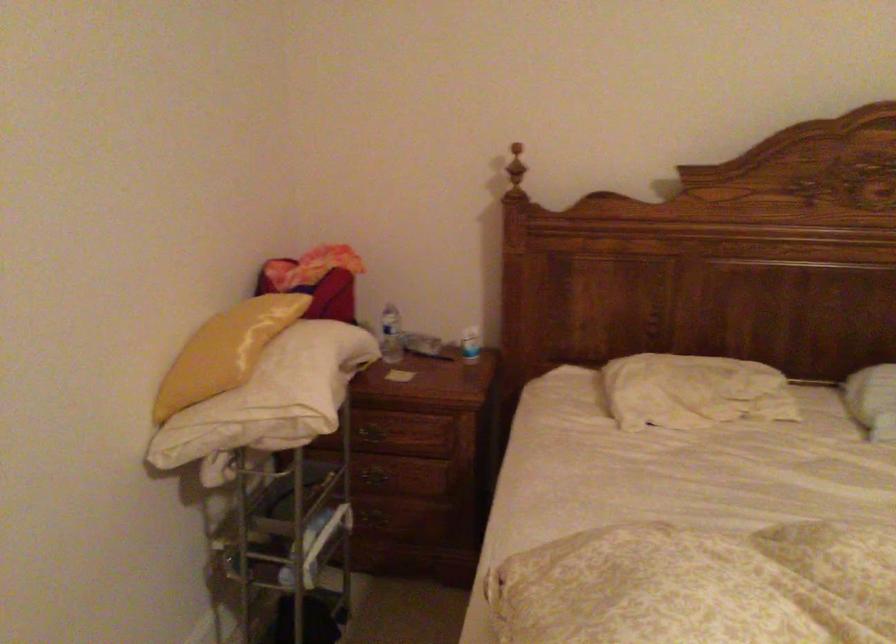
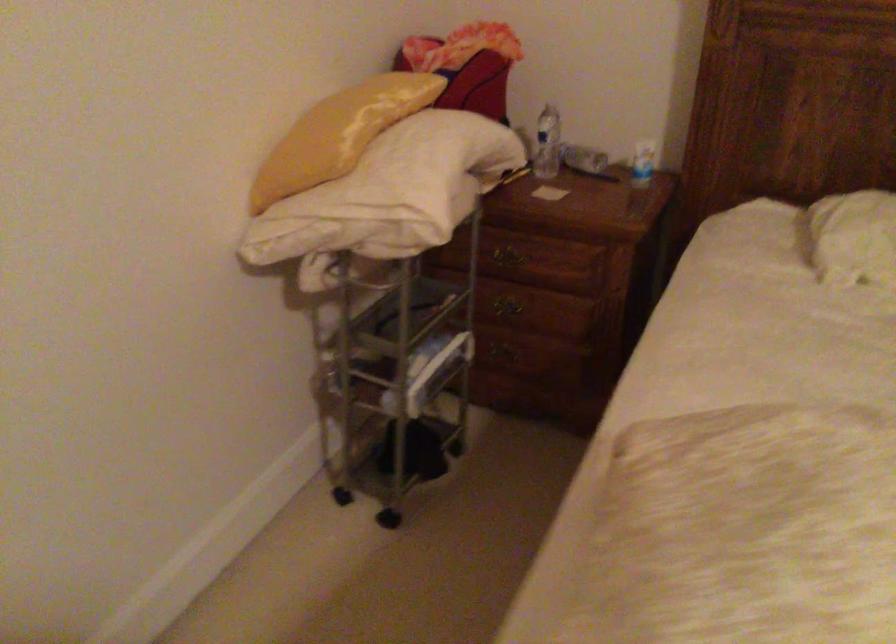
Question: What movement of the cameraman would produce the second image?

Choices:
 (A) Left
 (B) Right
 (C) Forward
 (D) Backward

Answer: (C)